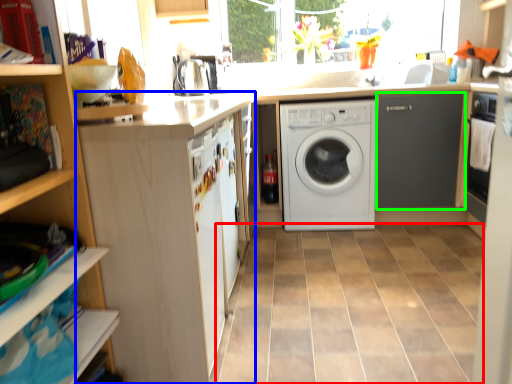
Question: Estimate the real-world distances between objects in this image. Which object is closer to ceramic tile (highlighted by a red box), cabinetry (highlighted by a blue box) or cabinetry (highlighted by a green box)?

Choices:
 (A) cabinetry
 (B) cabinetry

Answer: (A)